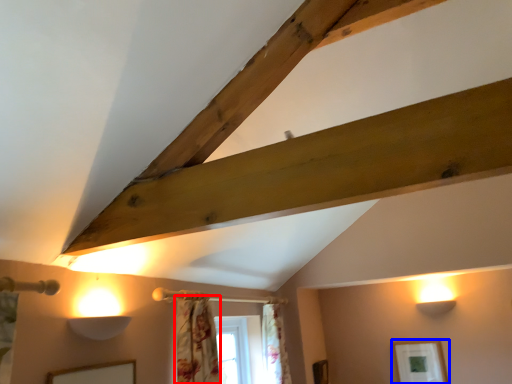
Question: Which point is further to the camera, curtain (highlighted by a red box) or picture frame (highlighted by a blue box)?

Choices:
 (A) curtain
 (B) picture frame

Answer: (B)